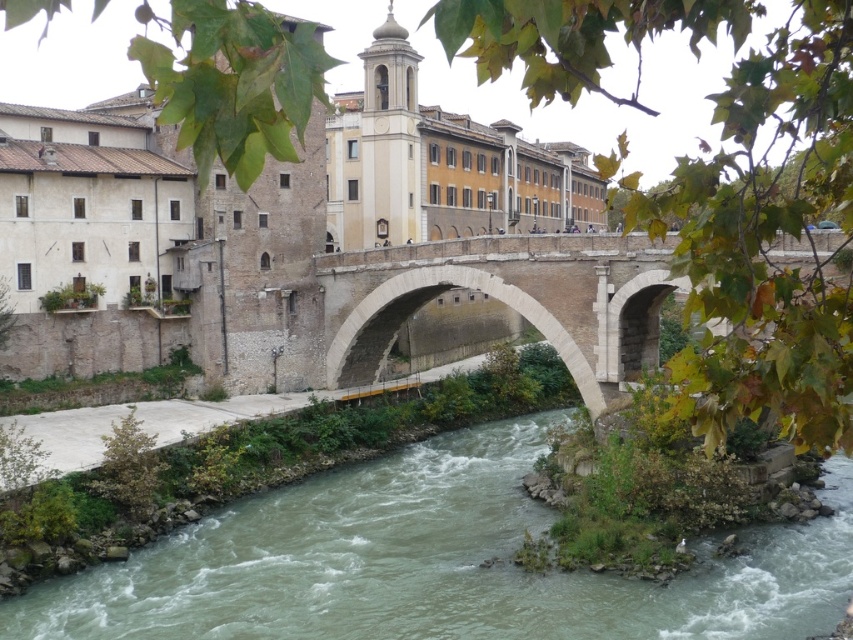
Is brown sedimentary rock river at lower center thinner than stone arch bridge at center?

No, brown sedimentary rock river at lower center is not thinner than stone arch bridge at center.

The height and width of the screenshot is (640, 853). Identify the location of brown sedimentary rock river at lower center. (436, 564).

The image size is (853, 640). I want to click on brown sedimentary rock river at lower center, so click(x=436, y=564).

Locate an element on the screen. The width and height of the screenshot is (853, 640). brown sedimentary rock river at lower center is located at coordinates (436, 564).